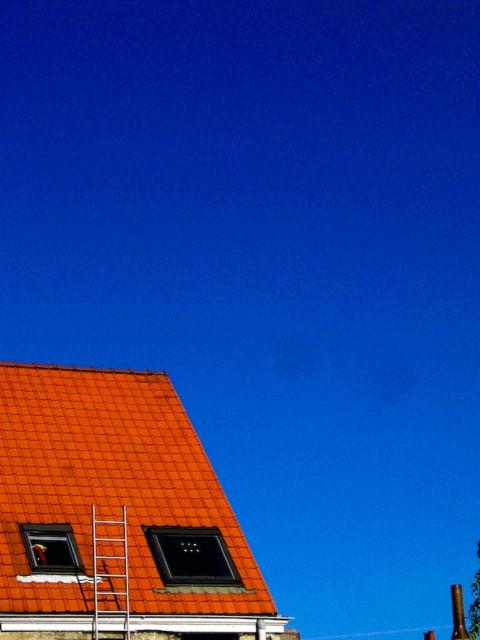
Question: Among these points, which one is farthest from the camera?

Choices:
 (A) (27, 404)
 (B) (112, 596)

Answer: (A)

Question: Does orange clay tiles at lower left appear under metallic silver ladder at upper left?

Choices:
 (A) no
 (B) yes

Answer: (A)

Question: Is orange clay tiles at lower left bigger than metallic silver ladder at upper left?

Choices:
 (A) no
 (B) yes

Answer: (B)

Question: Can you confirm if orange clay tiles at lower left is wider than metallic silver ladder at upper left?

Choices:
 (A) no
 (B) yes

Answer: (B)

Question: Which of the following is the farthest from the observer?

Choices:
 (A) (118, 573)
 (B) (107, 385)

Answer: (B)